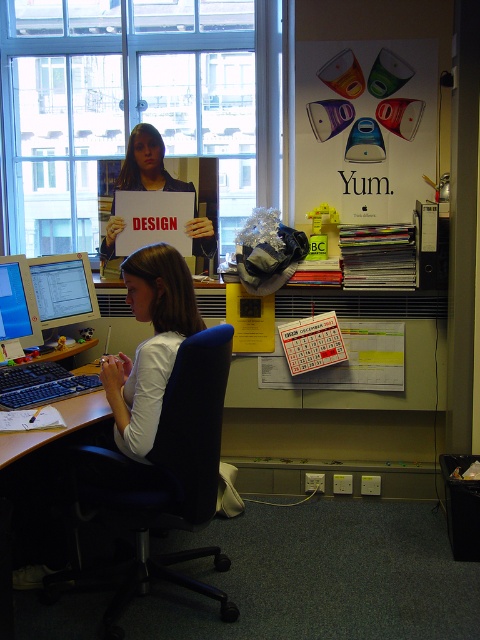
Is matte black sign at center to the left of black plastic keyboard at lower left from the viewer's perspective?

No, matte black sign at center is not to the left of black plastic keyboard at lower left.

What do you see at coordinates (147, 163) in the screenshot? This screenshot has height=640, width=480. I see `matte black sign at center` at bounding box center [147, 163].

Locate an element on the screen. This screenshot has width=480, height=640. matte black sign at center is located at coordinates (147, 163).

Does blue fabric swivel chair at center come in front of matte black sign at center?

Yes, blue fabric swivel chair at center is closer to the viewer.

Locate an element on the screen. Image resolution: width=480 pixels, height=640 pixels. blue fabric swivel chair at center is located at coordinates (164, 481).

Can you confirm if blue fabric swivel chair at center is shorter than black plastic keyboard at lower left?

Incorrect, blue fabric swivel chair at center's height does not fall short of black plastic keyboard at lower left's.

Does blue fabric swivel chair at center have a lesser width compared to black plastic keyboard at lower left?

No.

Where is `blue fabric swivel chair at center`? The height and width of the screenshot is (640, 480). blue fabric swivel chair at center is located at coordinates click(x=164, y=481).